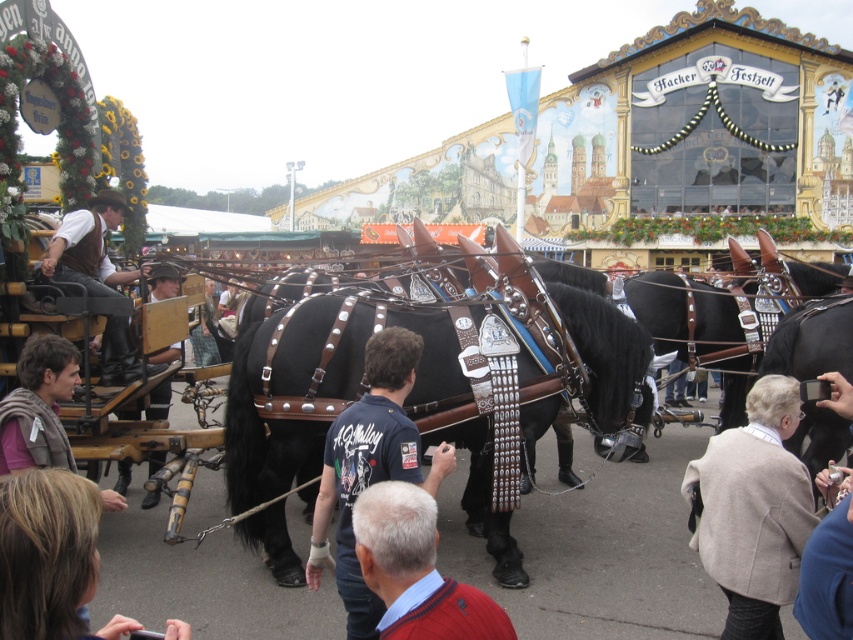
Between point (463, 500) and point (345, 458), which one is positioned behind?

The point (463, 500) is more distant.

Is point (277, 344) behind point (310, 566)?

Yes, point (277, 344) is farther from viewer.

The width and height of the screenshot is (853, 640). Identify the location of shiny black horse at center. (422, 388).

Is dark blue shirt at center taller than leather hat at center?

No.

Between point (340, 502) and point (161, 294), which one is positioned behind?

Point (161, 294)

This screenshot has height=640, width=853. What do you see at coordinates (369, 468) in the screenshot?
I see `dark blue shirt at center` at bounding box center [369, 468].

Image resolution: width=853 pixels, height=640 pixels. I want to click on dark blue shirt at center, so click(369, 468).

Which is above, beige wool sweater at lower right or leather hat at center?

Positioned higher is leather hat at center.

Is beige wool sweater at lower right wider than leather hat at center?

Correct, the width of beige wool sweater at lower right exceeds that of leather hat at center.

At what (x,y) coordinates should I click in order to perform the action: click on beige wool sweater at lower right. Please return your answer as a coordinate pair (x, y). The image size is (853, 640). Looking at the image, I should click on (752, 509).